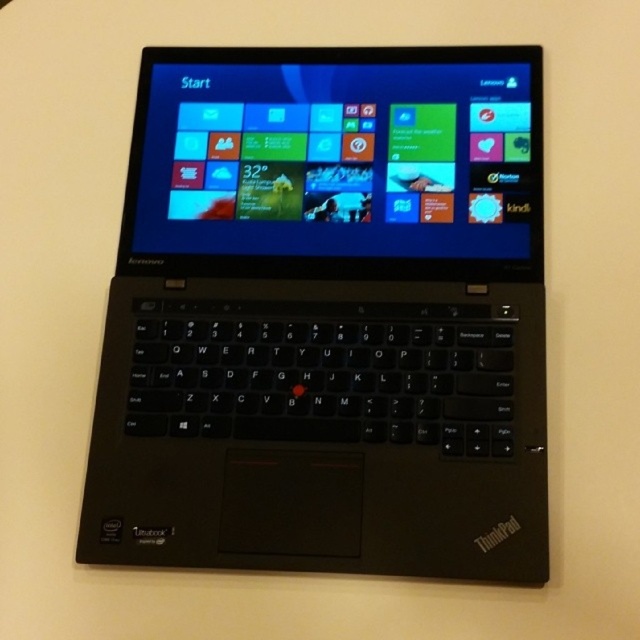
Which is above, black matte thinkpad at center or matte black screen at center?

Positioned higher is matte black screen at center.

Is black matte thinkpad at center above matte black screen at center?

No, black matte thinkpad at center is not above matte black screen at center.

Who is more distant from viewer, (106, 385) or (192, 177)?

The point (192, 177) is behind.

Locate an element on the screen. This screenshot has width=640, height=640. black matte thinkpad at center is located at coordinates (326, 317).